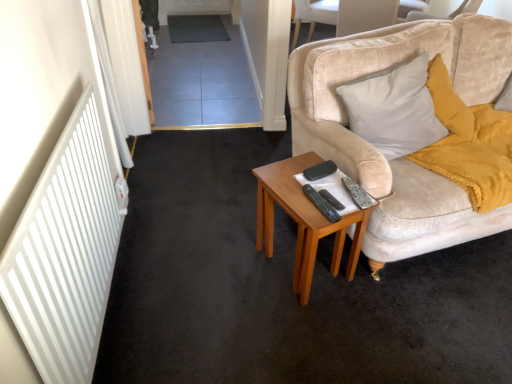
Question: Considering the positions of velvet beige chair at upper center and dark gray carpet at center in the image, is velvet beige chair at upper center bigger or smaller than dark gray carpet at center?

Choices:
 (A) small
 (B) big

Answer: (B)

Question: In the image, is velvet beige chair at upper center positioned in front of or behind dark gray carpet at center?

Choices:
 (A) front
 (B) behind

Answer: (A)

Question: Considering the real-world distances, which object is farthest from the silver metallic remote control at right, positioned as the 3th remote control in left-to-right order?

Choices:
 (A) black plastic remote control at center, which ranks as the 2th remote control in left-to-right order
 (B) velvet beige pillow at right
 (C) dark gray carpet at center
 (D) velvet beige chair at upper center
 (E) woodenobject at center

Answer: (C)

Question: Estimate the real-world distances between objects in this image. Which object is farther from the dark gray carpet at center?

Choices:
 (A) velvet beige chair at upper center
 (B) black plastic remote control at center, which ranks as the 2th remote control in left-to-right order
 (C) velvet beige pillow at right
 (D) black plastic remote control at center, the 1th remote control when ordered from left to right
 (E) silver metallic remote control at right, the 1th remote control in the right-to-left sequence

Answer: (B)